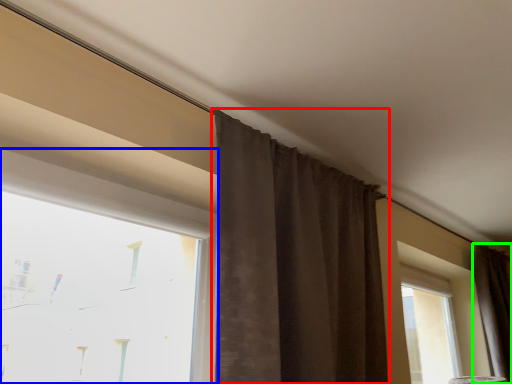
Question: Considering the real-world distances, which object is closest to curtain (highlighted by a red box)? window (highlighted by a blue box) or curtain (highlighted by a green box).

Choices:
 (A) window
 (B) curtain

Answer: (A)